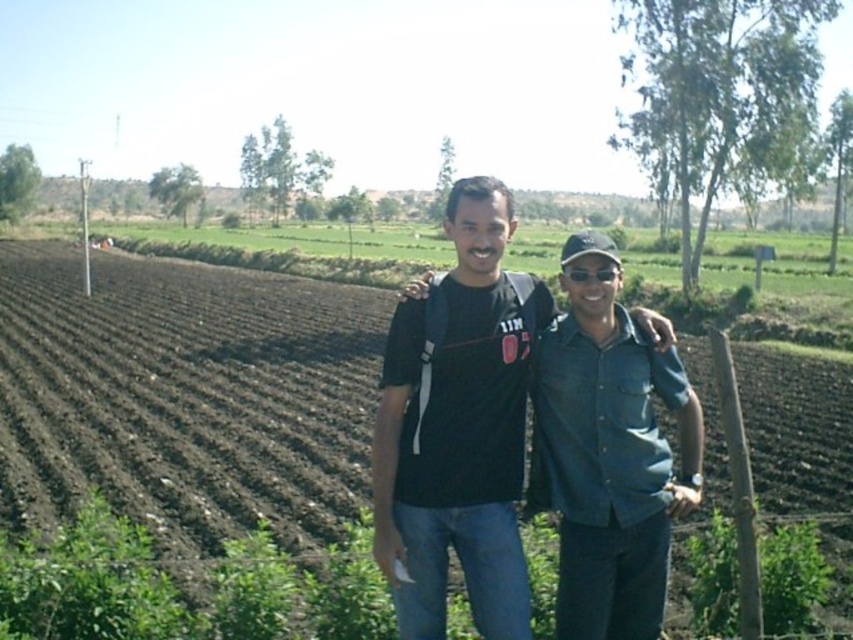
Which is more to the right, dark brown soil at center or black matte shirt at center?

From the viewer's perspective, black matte shirt at center appears more on the right side.

Does dark brown soil at center have a greater width compared to black matte shirt at center?

Indeed, dark brown soil at center has a greater width compared to black matte shirt at center.

Locate an element on the screen. The width and height of the screenshot is (853, 640). dark brown soil at center is located at coordinates (184, 396).